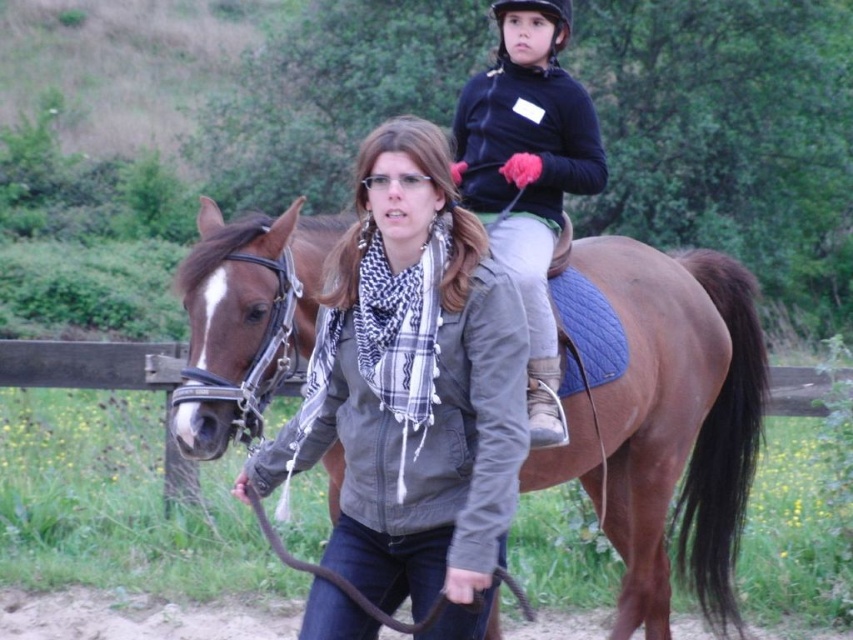
Who is more forward, (566,454) or (512,26)?

Point (566,454)

Does brown leather saddle at center appear on the right side of dark blue jersey at upper center?

Correct, you'll find brown leather saddle at center to the right of dark blue jersey at upper center.

Does point (311, 276) lie in front of point (570, 180)?

That is True.

Where is `brown leather saddle at center`? This screenshot has width=853, height=640. brown leather saddle at center is located at coordinates (659, 412).

From the picture: Who is positioned more to the right, matte gray jacket at center or dark blue jersey at upper center?

dark blue jersey at upper center

Is matte gray jacket at center positioned in front of dark blue jersey at upper center?

That is True.

I want to click on matte gray jacket at center, so click(413, 390).

Measure the distance between brown leather saddle at center and camera.

brown leather saddle at center and camera are 4.36 meters apart from each other.

Can you confirm if brown leather saddle at center is bigger than matte gray jacket at center?

Indeed, brown leather saddle at center has a larger size compared to matte gray jacket at center.

This screenshot has width=853, height=640. In order to click on brown leather saddle at center in this screenshot , I will do `click(659, 412)`.